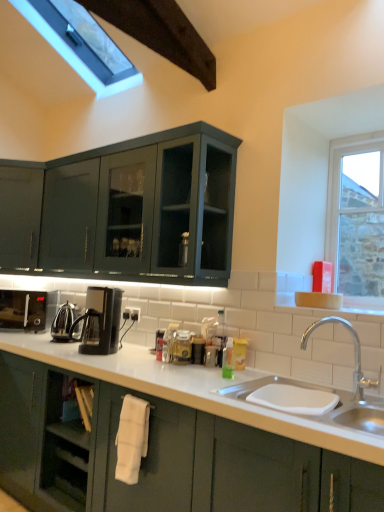
Locate an element on the screen. space that is in front of translucent glass spice jar at center, the 1th appliance positioned from the right is located at coordinates (187, 371).